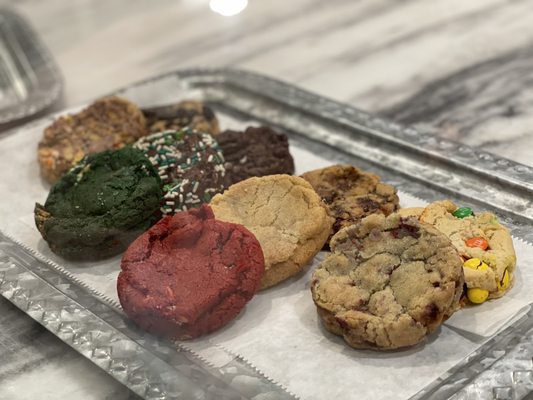
The image size is (533, 400). Identify the location of cookies on silver tray. (196, 274), (124, 197), (112, 120), (193, 116), (185, 160), (248, 142), (287, 205), (352, 190), (386, 252), (463, 225).